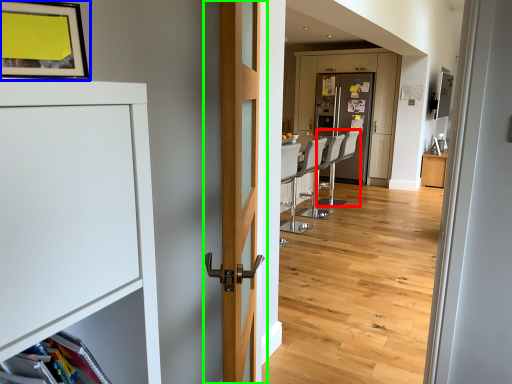
Question: Which object is positioned farthest from armchair (highlighted by a red box)? Select from picture frame (highlighted by a blue box) and door (highlighted by a green box).

Choices:
 (A) picture frame
 (B) door

Answer: (A)